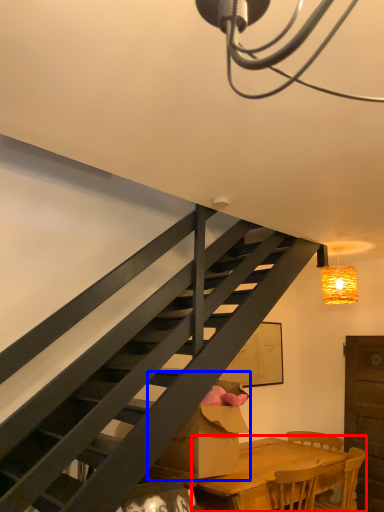
Question: Which of the following is the farthest to the observer, table (highlighted by a red box) or cardboard box (highlighted by a blue box)?

Choices:
 (A) table
 (B) cardboard box

Answer: (B)